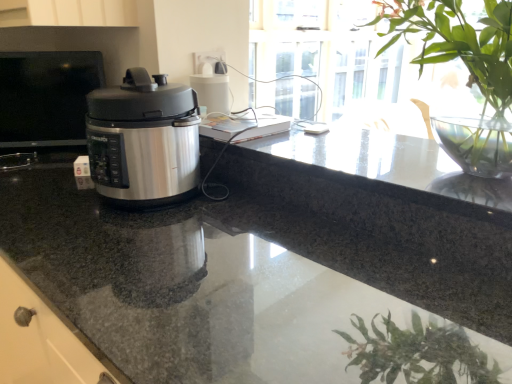
Question: Does metallic silver pressure cooker at left have a greater height compared to granite countertop at center?

Choices:
 (A) yes
 (B) no

Answer: (B)

Question: Can you confirm if metallic silver pressure cooker at left is bigger than granite countertop at center?

Choices:
 (A) no
 (B) yes

Answer: (A)

Question: Is metallic silver pressure cooker at left with granite countertop at center?

Choices:
 (A) no
 (B) yes

Answer: (A)

Question: Is metallic silver pressure cooker at left to the right of granite countertop at center from the viewer's perspective?

Choices:
 (A) no
 (B) yes

Answer: (A)

Question: From a real-world perspective, is metallic silver pressure cooker at left under granite countertop at center?

Choices:
 (A) no
 (B) yes

Answer: (A)

Question: From a real-world perspective, is metallic silver pressure cooker at left above or below green leafy plant at upper right?

Choices:
 (A) above
 (B) below

Answer: (B)

Question: Considering the positions of metallic silver pressure cooker at left and green leafy plant at upper right in the image, is metallic silver pressure cooker at left bigger or smaller than green leafy plant at upper right?

Choices:
 (A) small
 (B) big

Answer: (A)

Question: Visually, is metallic silver pressure cooker at left positioned to the left or to the right of green leafy plant at upper right?

Choices:
 (A) left
 (B) right

Answer: (A)

Question: Is metallic silver pressure cooker at left inside or outside of green leafy plant at upper right?

Choices:
 (A) outside
 (B) inside

Answer: (A)

Question: Is point (486, 162) positioned closer to the camera than point (262, 261)?

Choices:
 (A) closer
 (B) farther

Answer: (B)

Question: Is green leafy plant at upper right bigger or smaller than granite countertop at center?

Choices:
 (A) big
 (B) small

Answer: (B)

Question: In the image, is green leafy plant at upper right on the left side or the right side of granite countertop at center?

Choices:
 (A) left
 (B) right

Answer: (B)

Question: From the image's perspective, is green leafy plant at upper right above or below granite countertop at center?

Choices:
 (A) below
 (B) above

Answer: (B)

Question: Is granite countertop at center bigger or smaller than metallic silver pressure cooker at left?

Choices:
 (A) small
 (B) big

Answer: (B)

Question: Relative to metallic silver pressure cooker at left, is granite countertop at center in front or behind?

Choices:
 (A) front
 (B) behind

Answer: (A)